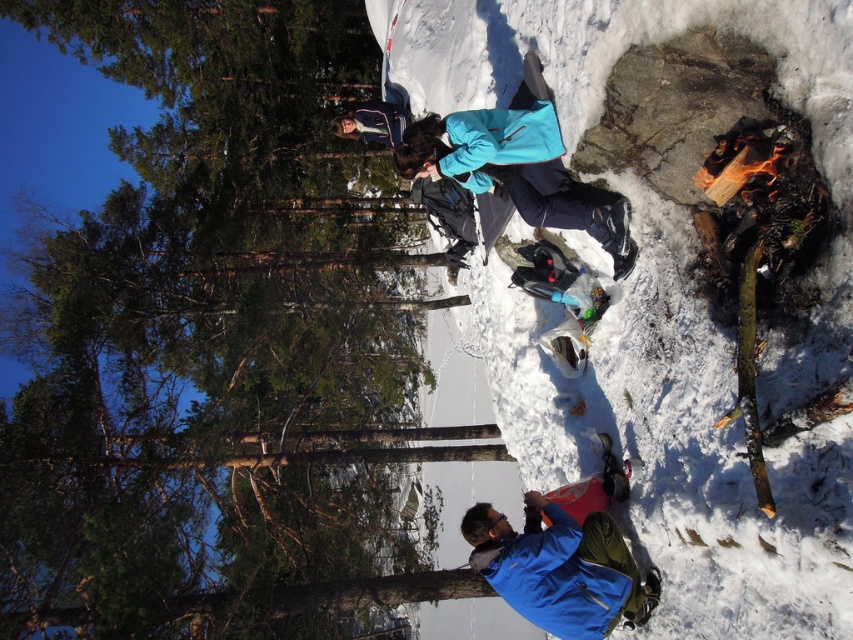
You are standing in the snowy forest and want to reach the green matte tree at upper left. If you can walk 1.5 meters per second, how long will it take you to reach the tree?

The green matte tree at upper left is 9.04 meters away from the viewer. At a walking speed of 1.5 meters per second, it would take approximately 6.03 seconds to reach the tree.

You are a hiker trying to locate your jacket in the snow. You see the green matte tree at upper left and the blue fabric jacket at lower center. Which object is closer to the top of the image?

The green matte tree at upper left is positioned over the blue fabric jacket at lower center, so it is closer to the top of the image.

You are planning to set up a tent in the snowy area shown. The tent requires a flat space wider than the blue fabric jacket at lower center. Is the white fluffy snow at lower right wide enough for your tent?

The white fluffy snow at lower right is wider than the blue fabric jacket at lower center, so yes, the white fluffy snow at lower right has sufficient width for the tent.